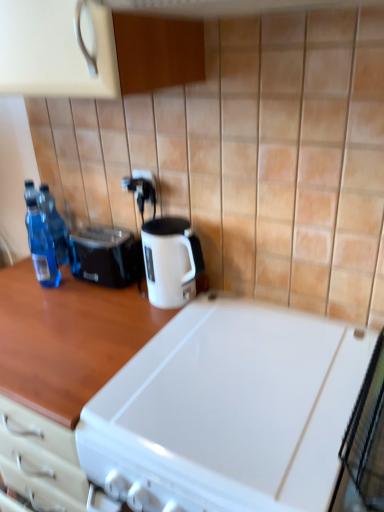
This screenshot has width=384, height=512. I want to click on free point in front of white glossy electric kettle at center, so click(143, 327).